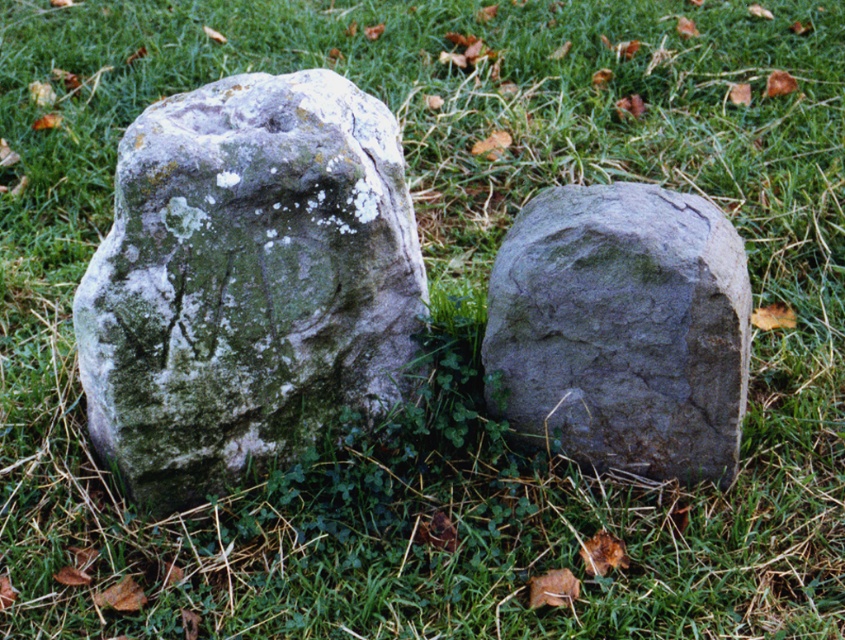
Question: Can you confirm if speckled gray stone at center is thinner than gray rough stone at center?

Choices:
 (A) no
 (B) yes

Answer: (A)

Question: Can you confirm if speckled gray stone at center is positioned above gray rough stone at center?

Choices:
 (A) yes
 (B) no

Answer: (A)

Question: Which point appears farthest from the camera in this image?

Choices:
 (A) (134, 298)
 (B) (595, 224)

Answer: (B)

Question: Among these objects, which one is nearest to the camera?

Choices:
 (A) gray rough stone at center
 (B) speckled gray stone at center

Answer: (B)

Question: Is speckled gray stone at center bigger than gray rough stone at center?

Choices:
 (A) no
 (B) yes

Answer: (B)

Question: Which object is closer to the camera taking this photo?

Choices:
 (A) gray rough stone at center
 (B) speckled gray stone at center

Answer: (B)